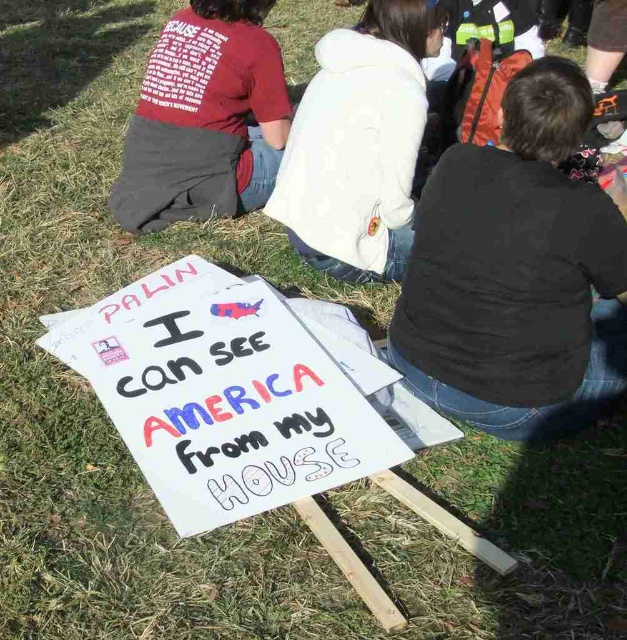
Question: Which object appears farthest from the camera in this image?

Choices:
 (A) black cotton shirt at center
 (B) matte red t-shirt at upper left

Answer: (B)

Question: Which object is the closest to the matte red t-shirt at upper left?

Choices:
 (A) white paper sign at center
 (B) black cotton shirt at center
 (C) white fleece jacket at center

Answer: (C)

Question: Does white paper sign at center come in front of white fleece jacket at center?

Choices:
 (A) yes
 (B) no

Answer: (A)

Question: Is white paper sign at center thinner than white fleece jacket at center?

Choices:
 (A) no
 (B) yes

Answer: (A)

Question: Is the position of black cotton shirt at center more distant than that of matte red t-shirt at upper left?

Choices:
 (A) yes
 (B) no

Answer: (B)

Question: Which object is farther from the camera taking this photo?

Choices:
 (A) black cotton shirt at center
 (B) white paper sign at center
 (C) white fleece jacket at center

Answer: (C)